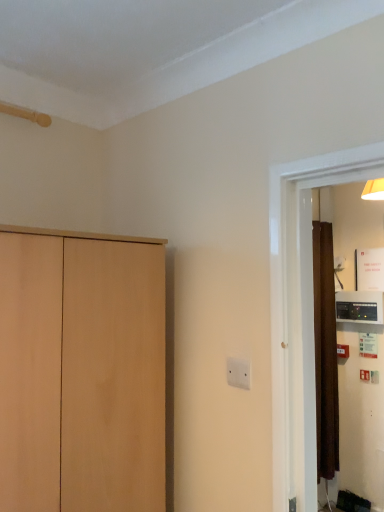
Question: Is light wood cupboard at left smaller than black plastic thermostat at right?

Choices:
 (A) yes
 (B) no

Answer: (B)

Question: From the image's perspective, would you say light wood cupboard at left is shown under black plastic thermostat at right?

Choices:
 (A) yes
 (B) no

Answer: (A)

Question: Is light wood cupboard at left to the right of black plastic thermostat at right from the viewer's perspective?

Choices:
 (A) no
 (B) yes

Answer: (A)

Question: Is light wood cupboard at left facing away from black plastic thermostat at right?

Choices:
 (A) no
 (B) yes

Answer: (A)

Question: Could you tell me if light wood cupboard at left is facing black plastic thermostat at right?

Choices:
 (A) no
 (B) yes

Answer: (A)

Question: Would you say white plastic electric outlet at center is to the left or to the right of black plastic thermostat at right in the picture?

Choices:
 (A) left
 (B) right

Answer: (A)

Question: In the image, is white plastic electric outlet at center positioned in front of or behind black plastic thermostat at right?

Choices:
 (A) behind
 (B) front

Answer: (B)

Question: Is white plastic electric outlet at center wider or thinner than black plastic thermostat at right?

Choices:
 (A) wide
 (B) thin

Answer: (B)

Question: From a real-world perspective, is white plastic electric outlet at center above or below black plastic thermostat at right?

Choices:
 (A) above
 (B) below

Answer: (B)

Question: Does point (246, 384) appear closer or farther from the camera than point (72, 448)?

Choices:
 (A) farther
 (B) closer

Answer: (A)

Question: From the image's perspective, is white plastic electric outlet at center located above or below light wood cupboard at left?

Choices:
 (A) below
 (B) above

Answer: (B)

Question: Is white plastic electric outlet at center in front of or behind light wood cupboard at left in the image?

Choices:
 (A) front
 (B) behind

Answer: (B)

Question: Is white plastic electric outlet at center bigger or smaller than light wood cupboard at left?

Choices:
 (A) big
 (B) small

Answer: (B)

Question: From a real-world perspective, is black plastic thermostat at right above or below light wood cupboard at left?

Choices:
 (A) above
 (B) below

Answer: (A)

Question: From the image's perspective, is black plastic thermostat at right above or below light wood cupboard at left?

Choices:
 (A) above
 (B) below

Answer: (A)